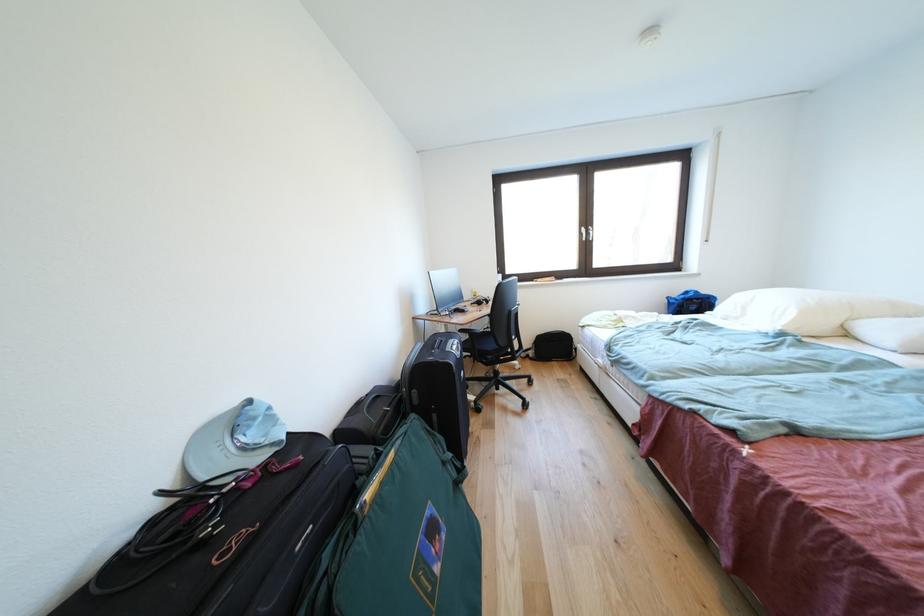
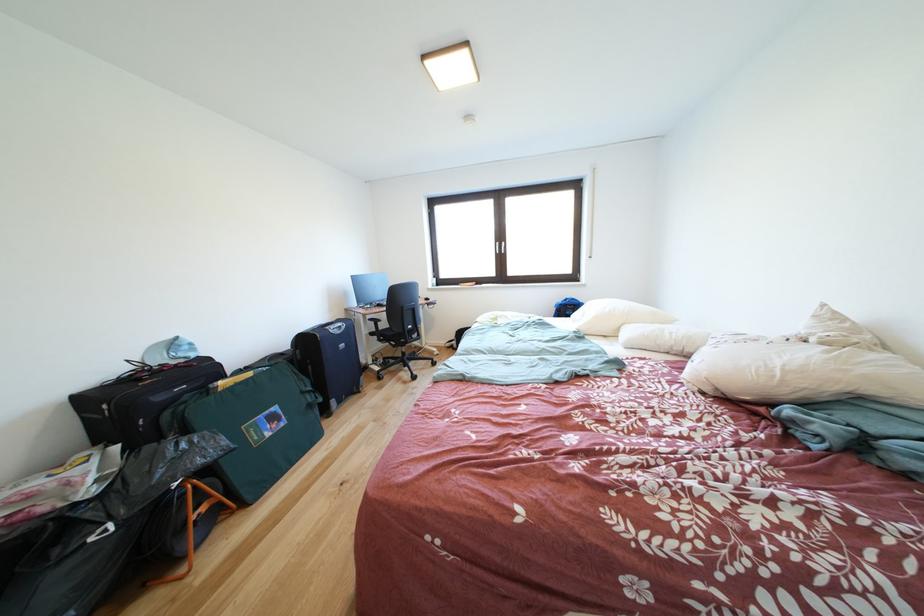
In the second image, find the point that corresponds to (591,233) in the first image.

(505, 249)